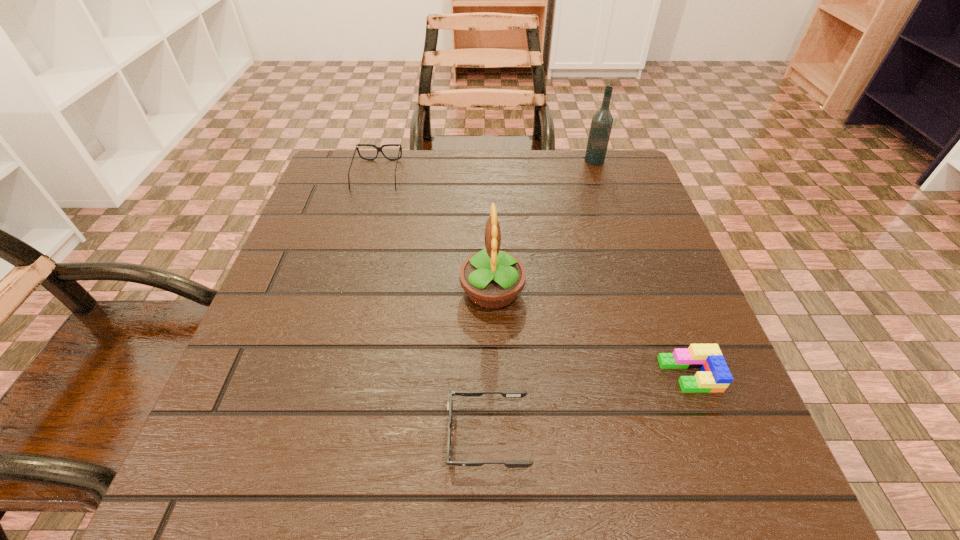
Locate an element on the screen. Image resolution: width=960 pixels, height=540 pixels. vacant space located 0.250m with the lenses facing outward on the spectacles is located at coordinates (351, 265).

Find the location of a particular element. Image resolution: width=960 pixels, height=540 pixels. free space located on the left of the fourth farthest object is located at coordinates (474, 375).

You are a GUI agent. You are given a task and a screenshot of the screen. Output one action in this format:
    pyautogui.click(x=<x>, y=<y>)
    Task: Click on the free space located 0.320m on the temples of the nearest object
    
    Given the screenshot: What is the action you would take?
    pyautogui.click(x=223, y=435)

You are a GUI agent. You are given a task and a screenshot of the screen. Output one action in this format:
    pyautogui.click(x=<x>, y=<y>)
    Task: Click on the free spot located on the temples of the nearest object
    The width and height of the screenshot is (960, 540).
    Given the screenshot: What is the action you would take?
    pyautogui.click(x=209, y=435)

Identify the location of vacant area situated 0.320m on the temples of the nearest object. This screenshot has width=960, height=540. (223, 435).

Where is `vodka at the far edge`? vodka at the far edge is located at coordinates (601, 125).

At what (x,y) coordinates should I click in order to perform the action: click on spectacles present at the far edge. Please return your answer as a coordinate pair (x, y). Looking at the image, I should click on (379, 149).

The width and height of the screenshot is (960, 540). I want to click on object that is at the near edge, so click(506, 393).

Image resolution: width=960 pixels, height=540 pixels. In order to click on object that is at the left edge in this screenshot , I will do `click(379, 149)`.

Where is `vodka located in the right edge section of the desktop`? This screenshot has width=960, height=540. vodka located in the right edge section of the desktop is located at coordinates pos(601,125).